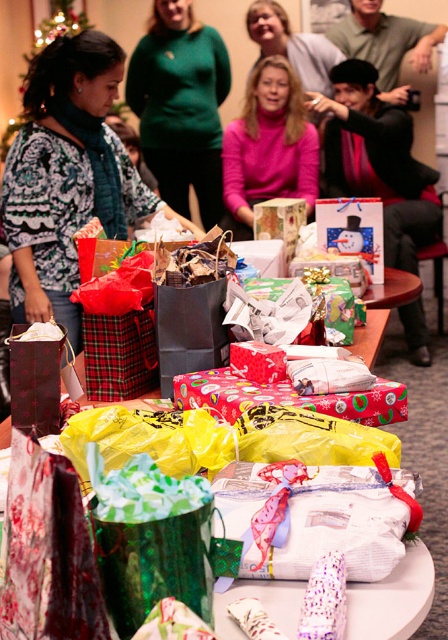
Question: Which point is farther from the camera taking this photo?

Choices:
 (A) (379, 310)
 (B) (361, 97)
 (C) (308, 561)
 (D) (280, 186)

Answer: (D)

Question: Which point appears farthest from the camera in this image?

Choices:
 (A) (172, 204)
 (B) (257, 168)

Answer: (A)

Question: Is pink matte sweater at center thinner than sparkly pink wrapping paper at center?

Choices:
 (A) no
 (B) yes

Answer: (A)

Question: Which object is the farthest from the shiny silver wrapping paper at center?

Choices:
 (A) green sweater at upper center
 (B) patterned fabric blouse at center
 (C) sparkly pink wrapping paper at center
 (D) matte black jacket at upper right

Answer: (A)

Question: Does matte black jacket at upper right appear on the left side of wrapping paper gifts at center?

Choices:
 (A) yes
 (B) no

Answer: (B)

Question: Is white paper wrapped at center bigger than pink matte sweater at center?

Choices:
 (A) no
 (B) yes

Answer: (A)